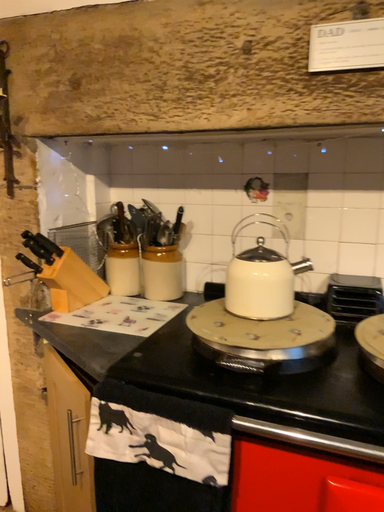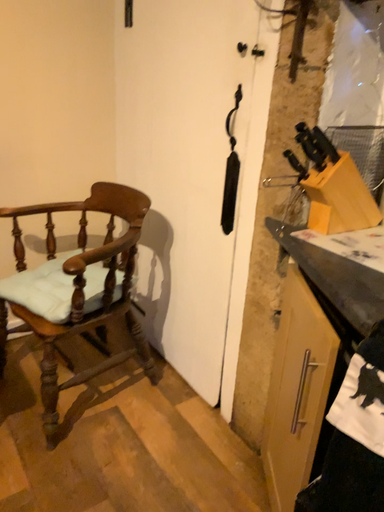
Question: Which way did the camera rotate in the video?

Choices:
 (A) rotated downward
 (B) rotated upward

Answer: (A)